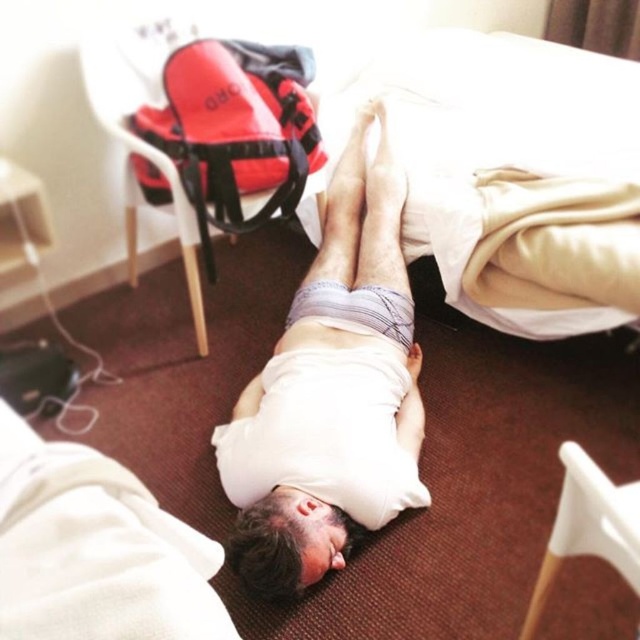
You are standing at the origin of the coordinate system in the image. You want to walk to the point labeled point (464, 218). Will you pass by point (339, 282) on your way there?

Yes, because point (464, 218) is in front of point (339, 282), so you will pass by point (339, 282) on your way there.

You are a photographer setting up a shoot in the room. You need to position a light source so that it illuminates the white cotton shirt at center without casting a shadow on the white soft bed at upper center. Is this possible given their current positions?

The white cotton shirt at center is behind the white soft bed at upper center, so positioning a light source to illuminate the shirt without casting a shadow on the bed would be challenging. The bed would likely block the light, creating a shadow on itself or the shirt.